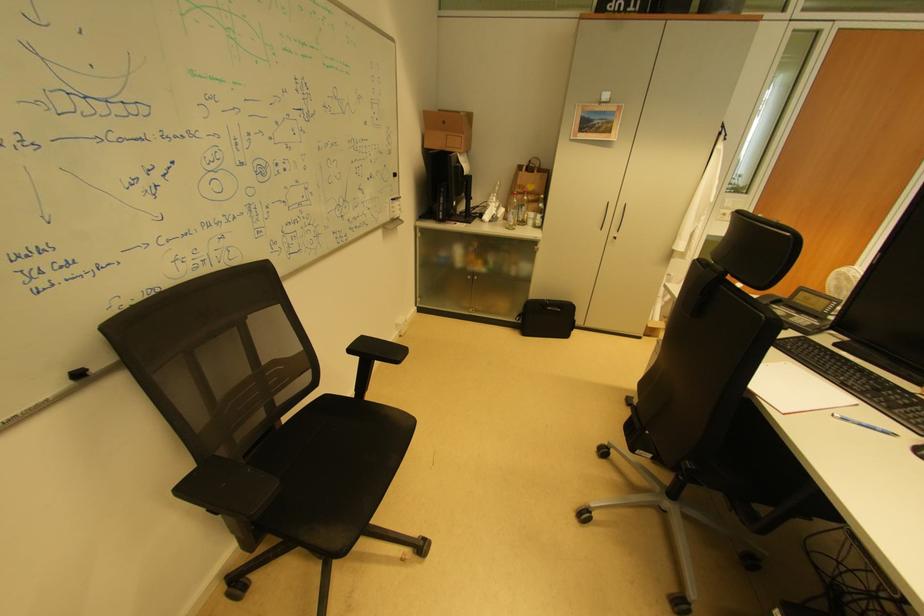
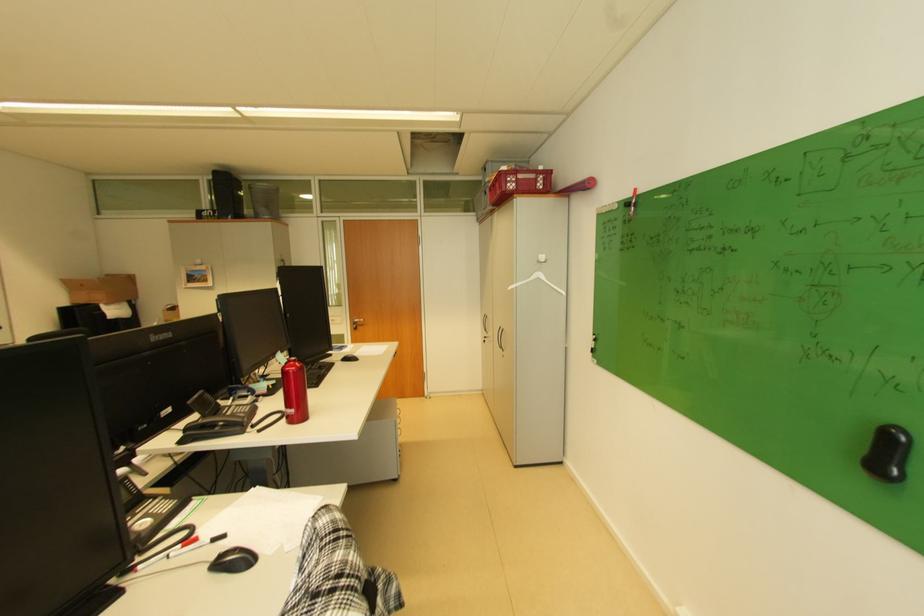
What movement of the cameraman would produce the second image?

The cameraman walked toward right, backward.